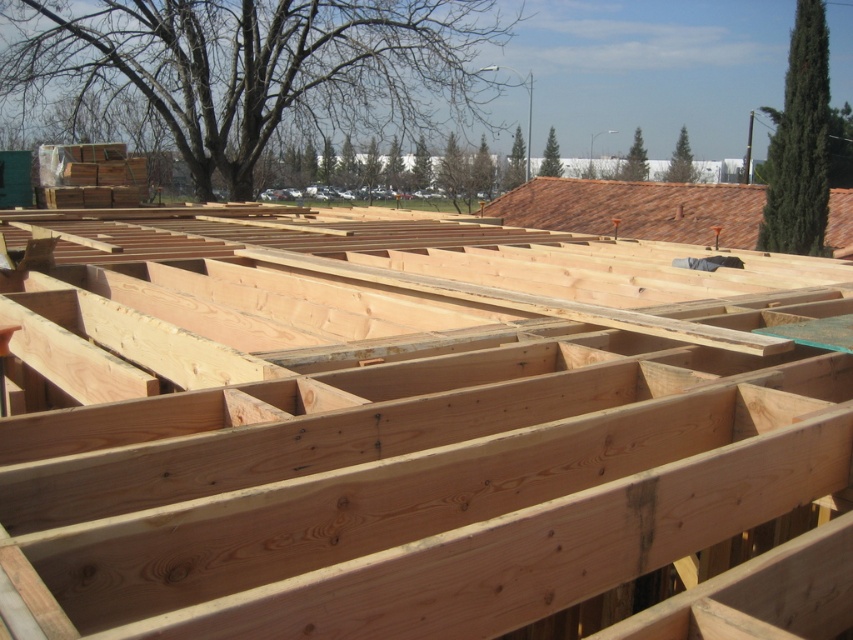
Does point (212, 445) lie behind point (735, 225)?

No, (212, 445) is closer to viewer.

Who is positioned more to the left, natural wood beams at center or brown tile roof at upper right?

natural wood beams at center is more to the left.

This screenshot has width=853, height=640. Find the location of `natural wood beams at center`. natural wood beams at center is located at coordinates (421, 436).